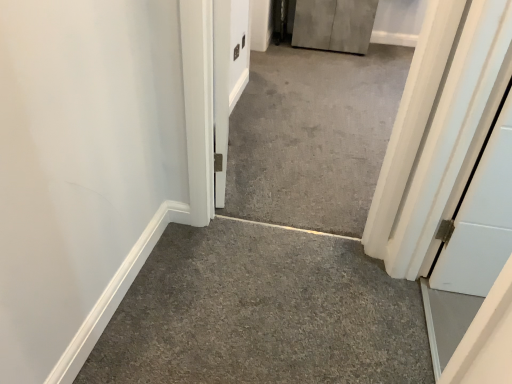
What do you see at coordinates (313, 136) in the screenshot? I see `gray concrete at center` at bounding box center [313, 136].

Find the location of a particular element. gray concrete at center is located at coordinates (313, 136).

What is the approximate height of gray concrete at center?

The height of gray concrete at center is 3.50 feet.

At what (x,y) coordinates should I click in order to perform the action: click on gray concrete at center. Please return your answer as a coordinate pair (x, y). Looking at the image, I should click on (313, 136).